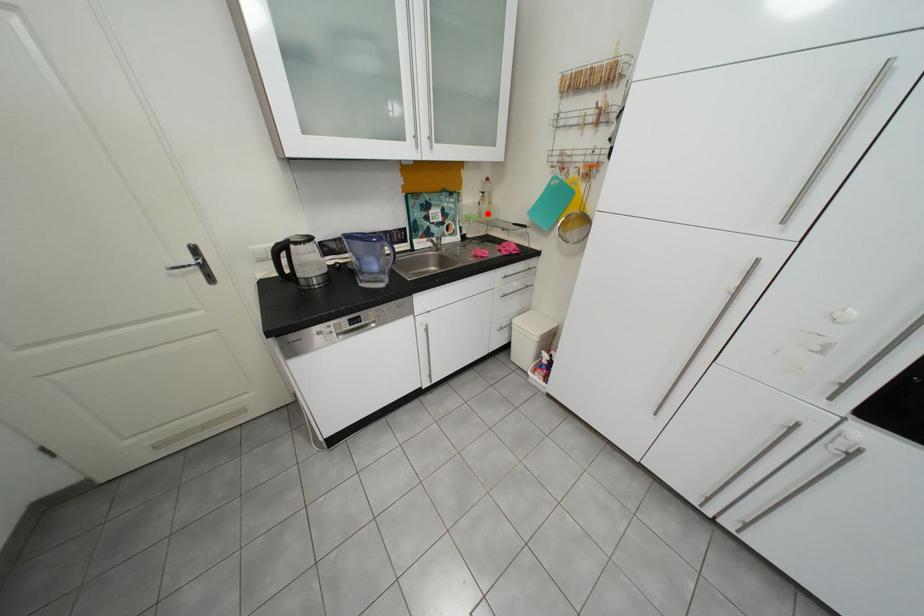
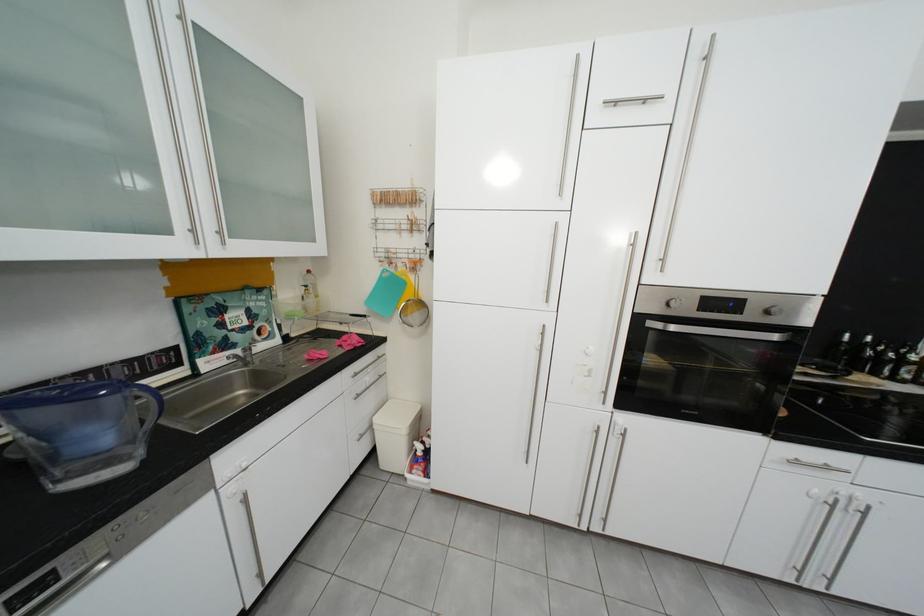
Question: I am providing you with two images of the same scene from different viewpoints. A red point is marked on the first image. Can you still see the location of the red point in image 2?

Choices:
 (A) Yes
 (B) No

Answer: (A)